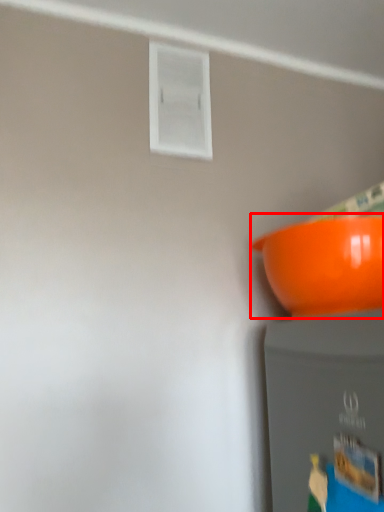
Question: From the image's perspective, where is bowl (annotated by the red box) located relative to window?

Choices:
 (A) below
 (B) above

Answer: (A)